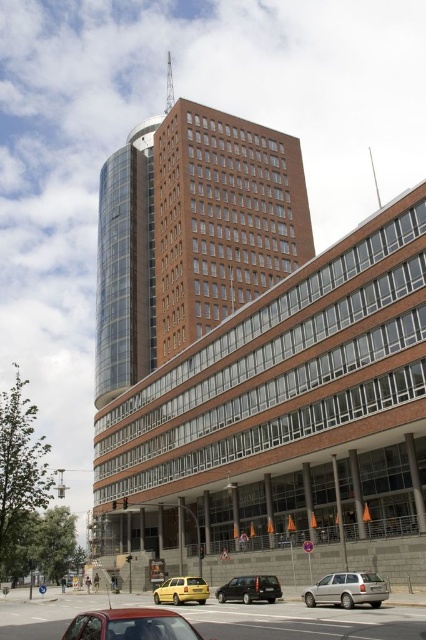
Does matte black van at center have a greater height compared to yellow matte taxi at lower center?

In fact, matte black van at center may be shorter than yellow matte taxi at lower center.

The width and height of the screenshot is (426, 640). What do you see at coordinates (250, 588) in the screenshot? I see `matte black van at center` at bounding box center [250, 588].

Find the location of a particular element. The height and width of the screenshot is (640, 426). matte black van at center is located at coordinates (250, 588).

Is point (127, 208) farther from camera compared to point (158, 589)?

Yes, point (127, 208) is farther from viewer.

Is transparent glass tower at upper left to the left of yellow matte taxi at lower center from the viewer's perspective?

Yes, transparent glass tower at upper left is to the left of yellow matte taxi at lower center.

Image resolution: width=426 pixels, height=640 pixels. What do you see at coordinates (126, 266) in the screenshot?
I see `transparent glass tower at upper left` at bounding box center [126, 266].

Where is `transparent glass tower at upper left`? The width and height of the screenshot is (426, 640). transparent glass tower at upper left is located at coordinates (126, 266).

Is transparent glass tower at upper left smaller than matte black van at center?

No, transparent glass tower at upper left is not smaller than matte black van at center.

Does transparent glass tower at upper left have a lesser height compared to matte black van at center?

No, transparent glass tower at upper left is not shorter than matte black van at center.

Locate an element on the screen. transparent glass tower at upper left is located at coordinates (126, 266).